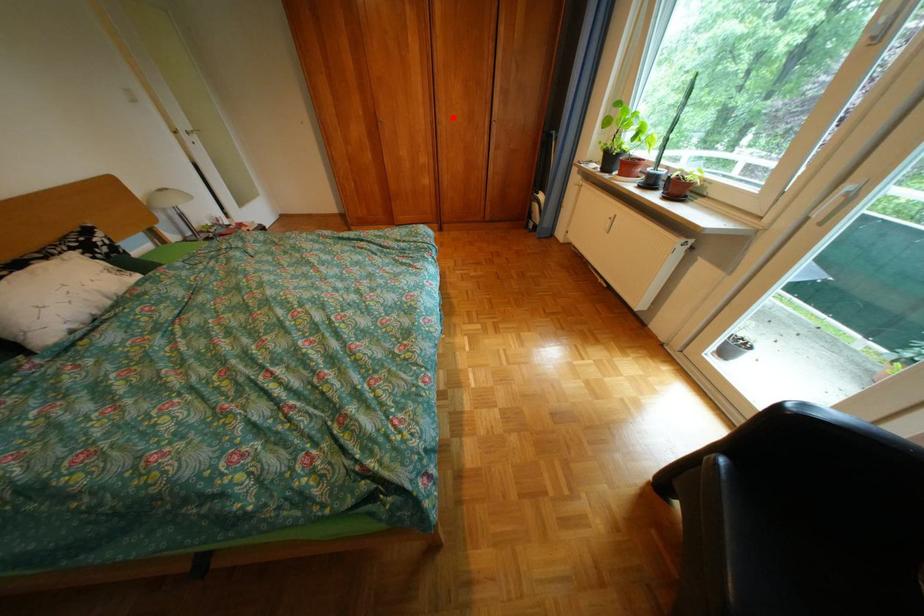
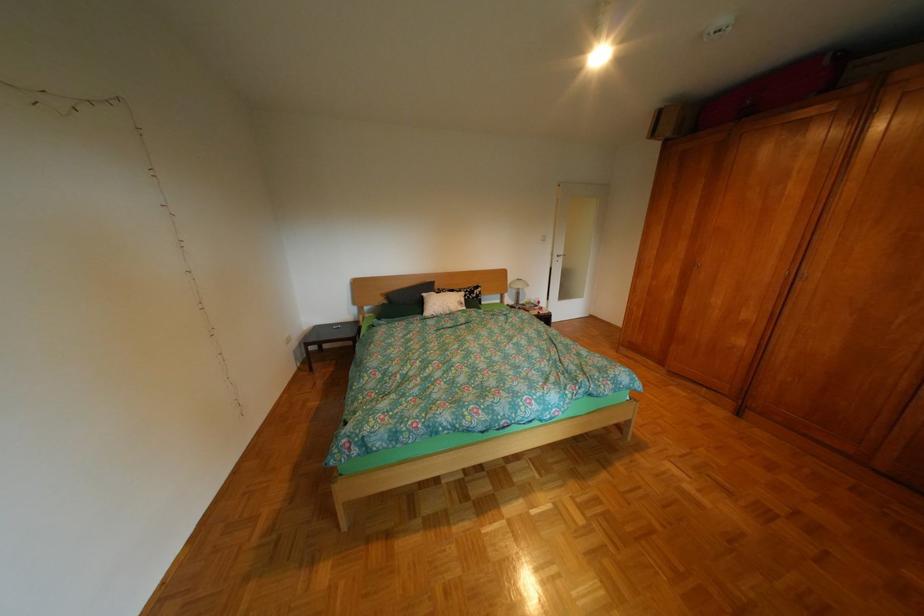
Question: I am providing you with two images of the same scene from different viewpoints. Given a red point in image1, look at the same physical point in image2. Is it:

Choices:
 (A) Closer to the viewpoint
 (B) Farther from the viewpoint

Answer: (B)